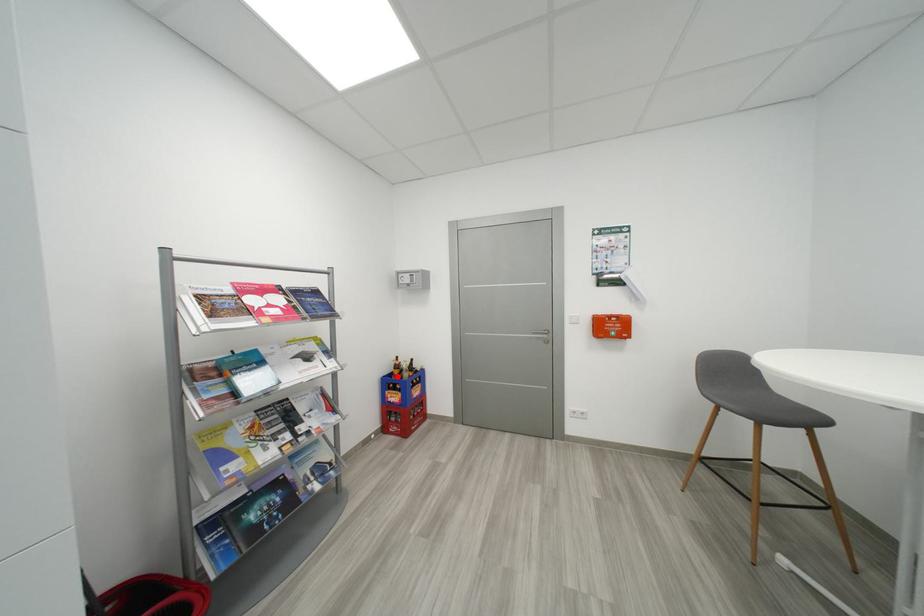
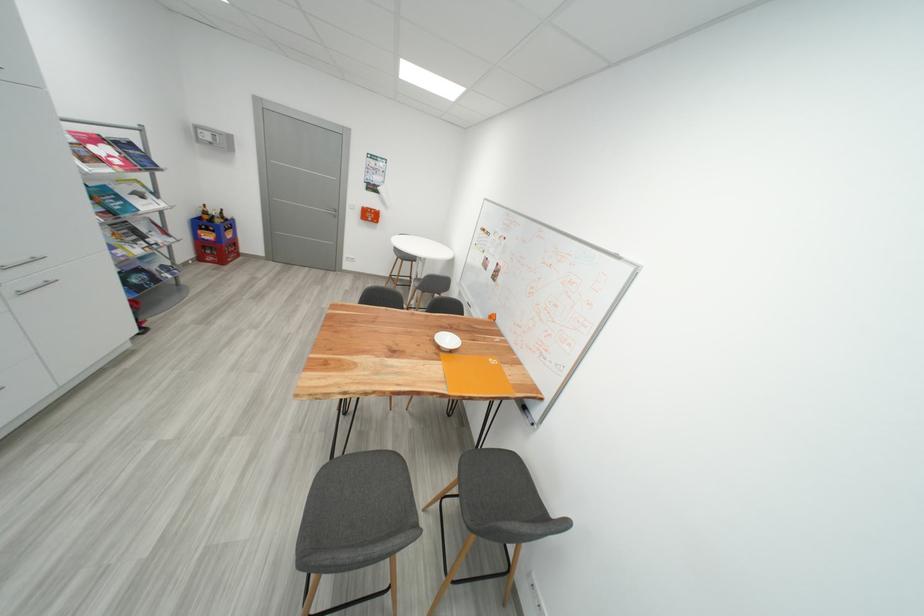
Question: I am providing you with two images of the same scene from different viewpoints. In image1, a red point is highlighted. Considering the same 3D point in image2, which of the following is correct?

Choices:
 (A) It is closer
 (B) It is farther

Answer: (A)